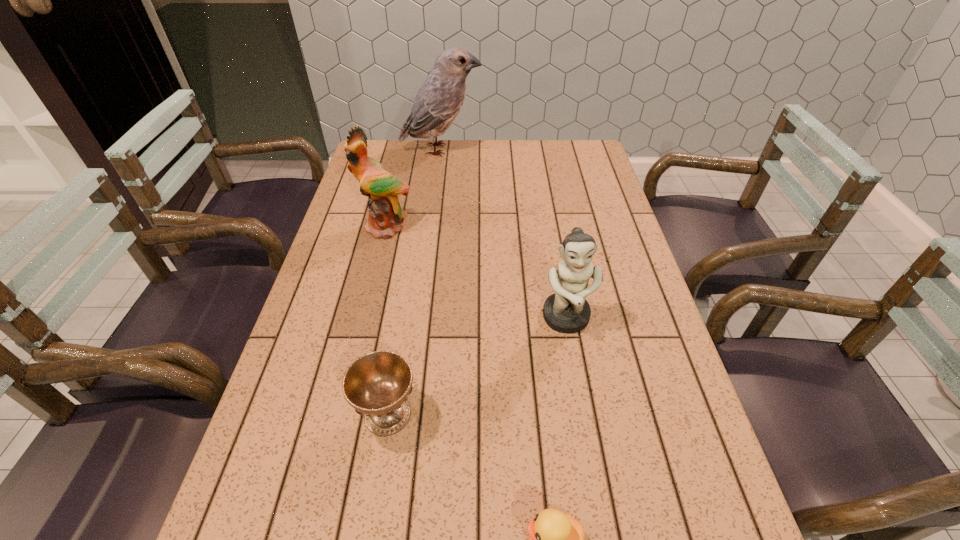
I want to click on the farthest object, so click(x=439, y=100).

The width and height of the screenshot is (960, 540). I want to click on the second farthest object, so click(x=385, y=213).

I want to click on figurine, so click(567, 311).

Image resolution: width=960 pixels, height=540 pixels. In order to click on the third shortest object in this screenshot , I will do `click(567, 311)`.

The width and height of the screenshot is (960, 540). What are the coordinates of `the second shortest object` in the screenshot? It's located at (376, 385).

Image resolution: width=960 pixels, height=540 pixels. Find the location of `chalice`. chalice is located at coordinates (376, 385).

Locate an element on the screen. The width and height of the screenshot is (960, 540). blank area located 0.120m on the front-facing side of the farther parrot is located at coordinates (515, 150).

Where is `blank area located 0.350m on the front-facing side of the second farthest object`? blank area located 0.350m on the front-facing side of the second farthest object is located at coordinates (358, 340).

Identify the location of vacant area situated on the front-facing side of the third tallest object. (604, 528).

At what (x,y) coordinates should I click in order to perform the action: click on vacant space located on the back of the fourth farthest object. Please return your answer as a coordinate pair (x, y). Looking at the image, I should click on (406, 296).